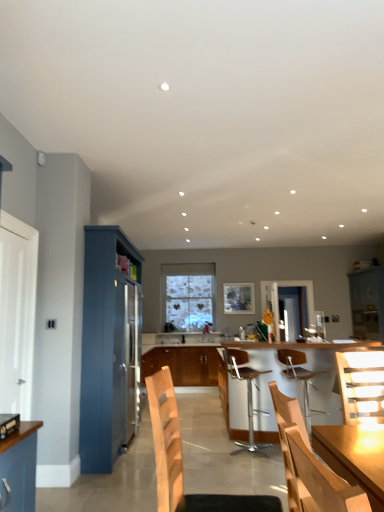
Question: Can you confirm if wooden chair at center, placed as the 1th chair when sorted from front to back, is taller than wooden chair at center, which is the 4th chair from back to front?

Choices:
 (A) no
 (B) yes

Answer: (A)

Question: Does wooden chair at center, the fifth chair from the back, have a lesser height compared to wooden chair at center, which is counted as the 2th chair, starting from the front?

Choices:
 (A) no
 (B) yes

Answer: (B)

Question: Is wooden chair at center, placed as the 1th chair when sorted from front to back, wider than wooden chair at center, which is counted as the 2th chair, starting from the front?

Choices:
 (A) yes
 (B) no

Answer: (B)

Question: Considering the relative sizes of wooden chair at center, the fifth chair from the back, and wooden chair at center, which is counted as the 2th chair, starting from the front, in the image provided, is wooden chair at center, the fifth chair from the back, smaller than wooden chair at center, which is counted as the 2th chair, starting from the front,?

Choices:
 (A) yes
 (B) no

Answer: (A)

Question: Can you confirm if wooden chair at center, placed as the 1th chair when sorted from front to back, is positioned to the right of wooden chair at center, which is the 4th chair from back to front?

Choices:
 (A) yes
 (B) no

Answer: (A)

Question: Is wooden chair at center, placed as the 1th chair when sorted from front to back, facing away from wooden chair at center, which is the 4th chair from back to front?

Choices:
 (A) yes
 (B) no

Answer: (B)

Question: Is there a large distance between wooden chair at center, placed as the 1th chair when sorted from front to back, and metallic silver bar stool at center, the 4th chair when ordered from front to back?

Choices:
 (A) no
 (B) yes

Answer: (B)

Question: Is wooden chair at center, placed as the 1th chair when sorted from front to back, at the right side of metallic silver bar stool at center, the 4th chair when ordered from front to back?

Choices:
 (A) no
 (B) yes

Answer: (A)

Question: Considering the relative sizes of wooden chair at center, the fifth chair from the back, and metallic silver bar stool at center, acting as the 2th chair starting from the back, in the image provided, is wooden chair at center, the fifth chair from the back, shorter than metallic silver bar stool at center, acting as the 2th chair starting from the back,?

Choices:
 (A) no
 (B) yes

Answer: (B)

Question: Is wooden chair at center, placed as the 1th chair when sorted from front to back, directly adjacent to metallic silver bar stool at center, acting as the 2th chair starting from the back?

Choices:
 (A) yes
 (B) no

Answer: (B)

Question: Would you say metallic silver bar stool at center, acting as the 2th chair starting from the back, is part of wooden chair at center, placed as the 1th chair when sorted from front to back,'s contents?

Choices:
 (A) yes
 (B) no

Answer: (B)

Question: Can you confirm if wooden chair at center, placed as the 1th chair when sorted from front to back, is smaller than metallic silver bar stool at center, acting as the 2th chair starting from the back?

Choices:
 (A) no
 (B) yes

Answer: (B)

Question: Can you confirm if wooden cabinet at center, placed as the 2th cabinetry when sorted from left to right, is thinner than metallic silver bar stool at center, acting as the 2th chair starting from the back?

Choices:
 (A) no
 (B) yes

Answer: (A)